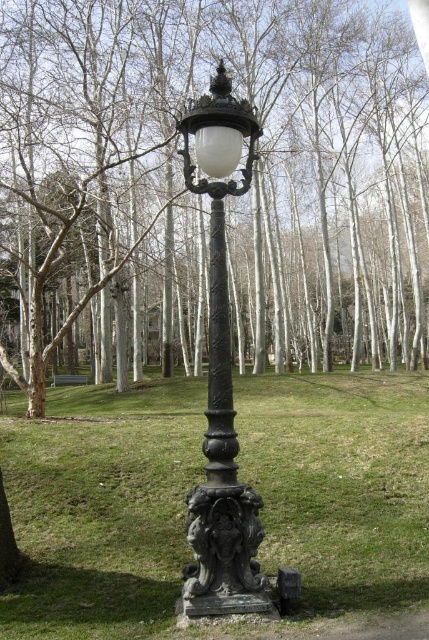
Is green grass at center wider than black cast iron pole at center?

Correct, the width of green grass at center exceeds that of black cast iron pole at center.

Which of these two, green grass at center or black cast iron pole at center, stands taller?

black cast iron pole at center

The height and width of the screenshot is (640, 429). I want to click on green grass at center, so click(x=103, y=513).

Image resolution: width=429 pixels, height=640 pixels. I want to click on green grass at center, so click(x=103, y=513).

Between point (221, 550) and point (192, 173), which one is positioned behind?

Point (192, 173)

Can you confirm if black cast iron street light at center is wider than matte black lamp post at center?

Indeed, black cast iron street light at center has a greater width compared to matte black lamp post at center.

Where is `black cast iron street light at center`? This screenshot has height=640, width=429. black cast iron street light at center is located at coordinates (220, 380).

This screenshot has height=640, width=429. In order to click on black cast iron street light at center in this screenshot , I will do `click(220, 380)`.

Does brown wood tree at center have a greater height compared to green grass at center?

Correct, brown wood tree at center is much taller as green grass at center.

Is point (117, 45) farther from camera compared to point (156, 499)?

Yes, it is behind point (156, 499).

You are a GUI agent. You are given a task and a screenshot of the screen. Output one action in this format:
    pyautogui.click(x=<x>, y=<y>)
    Task: Click on the brown wood tree at center
    The image size is (429, 640).
    Given the screenshot: What is the action you would take?
    pyautogui.click(x=211, y=180)